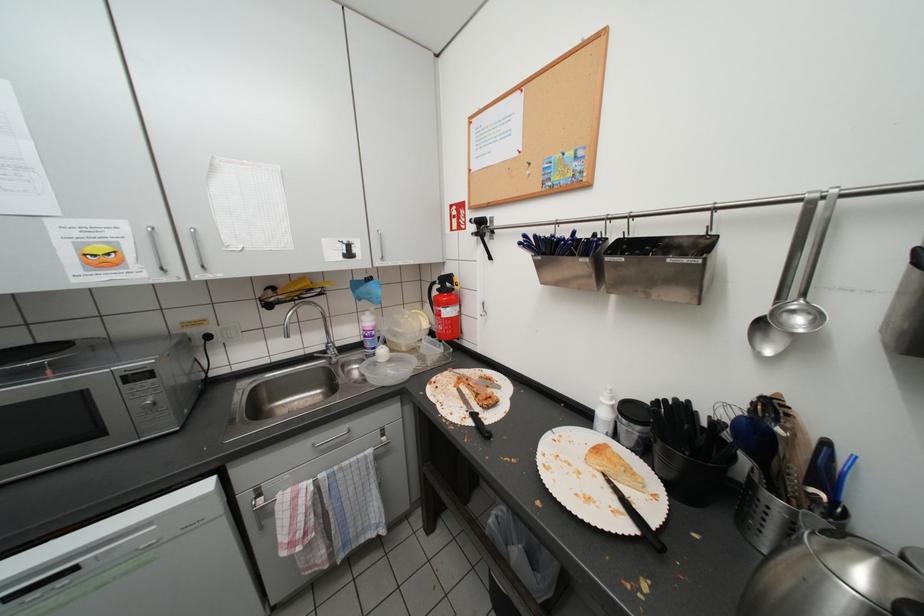
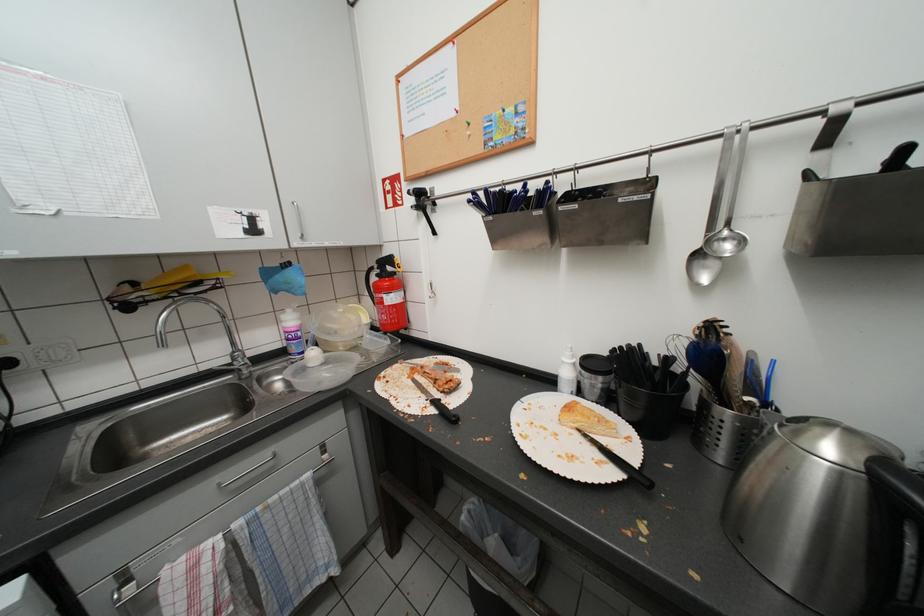
In a continuous first-person perspective shot, in which direction is the camera moving?

The cameraman moved toward left, forward.